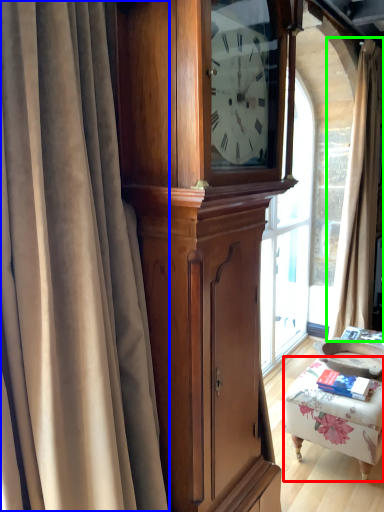
Question: Which object is positioned closest to furniture (highlighted by a red box)? Select from curtain (highlighted by a blue box) and curtain (highlighted by a green box).

Choices:
 (A) curtain
 (B) curtain

Answer: (B)